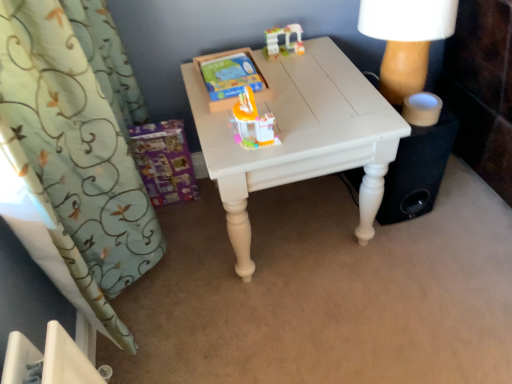
Question: Is white painted wood table at center completely or partially outside of translucent plastic building at upper center, placed as the first toy when sorted from back to front?

Choices:
 (A) no
 (B) yes

Answer: (B)

Question: Does white painted wood table at center turn towards translucent plastic building at upper center, which is the 1th toy in top-to-bottom order?

Choices:
 (A) yes
 (B) no

Answer: (B)

Question: Is the depth of white painted wood table at center greater than that of translucent plastic building at upper center, which is counted as the 2th toy, starting from the bottom?

Choices:
 (A) no
 (B) yes

Answer: (A)

Question: Does white painted wood table at center have a greater width compared to translucent plastic building at upper center, which is counted as the 2th toy, starting from the bottom?

Choices:
 (A) yes
 (B) no

Answer: (A)

Question: From a real-world perspective, is white painted wood table at center below translucent plastic building at upper center, which is counted as the 2th toy, starting from the bottom?

Choices:
 (A) yes
 (B) no

Answer: (A)

Question: In terms of width, does green floral fabric curtain at left look wider or thinner when compared to translucent plastic building at upper center, which is counted as the 2th toy, starting from the bottom?

Choices:
 (A) thin
 (B) wide

Answer: (B)

Question: From the image's perspective, relative to translucent plastic building at upper center, which is the 1th toy in top-to-bottom order, is green floral fabric curtain at left above or below?

Choices:
 (A) below
 (B) above

Answer: (A)

Question: From a real-world perspective, is green floral fabric curtain at left positioned above or below translucent plastic building at upper center, which is the 1th toy in top-to-bottom order?

Choices:
 (A) below
 (B) above

Answer: (A)

Question: Considering the positions of green floral fabric curtain at left and translucent plastic building at upper center, marked as the 2th toy in a front-to-back arrangement, in the image, is green floral fabric curtain at left taller or shorter than translucent plastic building at upper center, marked as the 2th toy in a front-to-back arrangement,?

Choices:
 (A) short
 (B) tall

Answer: (B)

Question: From a real-world perspective, is translucent plastic toy at center, acting as the second toy starting from the top, above or below green floral fabric curtain at left?

Choices:
 (A) above
 (B) below

Answer: (A)

Question: From the image's perspective, is translucent plastic toy at center, the second toy when ordered from back to front, located above or below green floral fabric curtain at left?

Choices:
 (A) above
 (B) below

Answer: (A)

Question: Do you think translucent plastic toy at center, the second toy when ordered from back to front, is within green floral fabric curtain at left, or outside of it?

Choices:
 (A) inside
 (B) outside

Answer: (B)

Question: Considering the positions of translucent plastic toy at center, the second toy when ordered from back to front, and green floral fabric curtain at left in the image, is translucent plastic toy at center, the second toy when ordered from back to front, taller or shorter than green floral fabric curtain at left?

Choices:
 (A) short
 (B) tall

Answer: (A)

Question: Is point (112, 26) closer or farther from the camera than point (254, 104)?

Choices:
 (A) farther
 (B) closer

Answer: (A)

Question: Based on their sizes in the image, would you say green floral fabric curtain at left is bigger or smaller than translucent plastic toy at center, which is the 1th toy from bottom to top?

Choices:
 (A) big
 (B) small

Answer: (A)